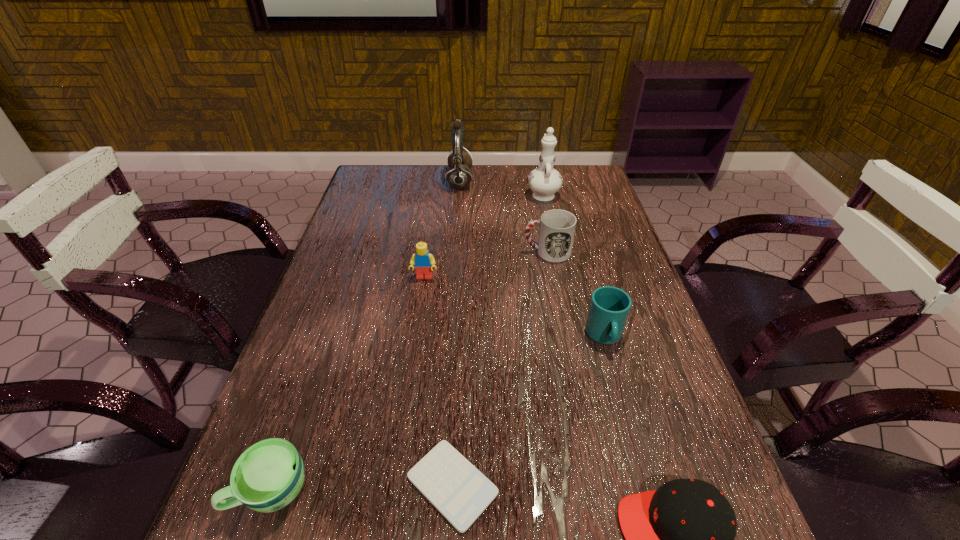
The image size is (960, 540). Identify the location of vacant area situated 0.110m at the spout of the chinaware. (538, 167).

The width and height of the screenshot is (960, 540). I want to click on vacant space located at the spout of the chinaware, so click(x=538, y=168).

The height and width of the screenshot is (540, 960). In order to click on vacant area situated on the side of the farthest cup where the handle is located in this screenshot , I will do `click(414, 252)`.

The height and width of the screenshot is (540, 960). Identify the location of free location located on the side of the farthest cup where the handle is located. (433, 252).

What are the coordinates of `vacant space located on the side of the farthest cup where the handle is located` in the screenshot? It's located at (384, 252).

This screenshot has height=540, width=960. What are the coordinates of `vacant area located on the front-facing side of the fourth farthest object` in the screenshot? It's located at (421, 296).

The width and height of the screenshot is (960, 540). Identify the location of blank space located 0.150m on the handle side of the second farthest cup. [x=628, y=421].

I want to click on vacant space located on the right of the leftmost object, so click(434, 490).

Locate an element on the screen. The width and height of the screenshot is (960, 540). free spot located on the right of the shortest object is located at coordinates (703, 485).

Where is `earphone present at the far edge`? earphone present at the far edge is located at coordinates (458, 175).